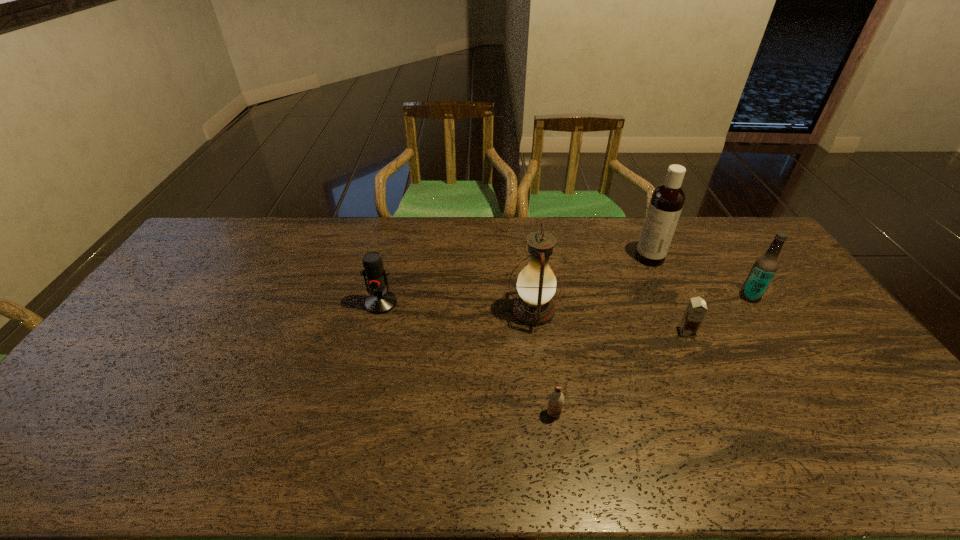
Where is `vacant space that satisfies the following two spatial constraints: 1. on the back side of the right chocolate milk; 2. on the label side of the dishwasher detergent`? This screenshot has width=960, height=540. vacant space that satisfies the following two spatial constraints: 1. on the back side of the right chocolate milk; 2. on the label side of the dishwasher detergent is located at coordinates (652, 258).

The width and height of the screenshot is (960, 540). What are the coordinates of `free point that satisfies the following two spatial constraints: 1. on the label side of the dishwasher detergent; 2. on the side of the third shortest object with the red ring` in the screenshot? It's located at click(671, 303).

In order to click on vacant space that satisfies the following two spatial constraints: 1. on the side of the oil lamp with the red ring; 2. on the left side of the microphone in this screenshot , I will do `click(379, 311)`.